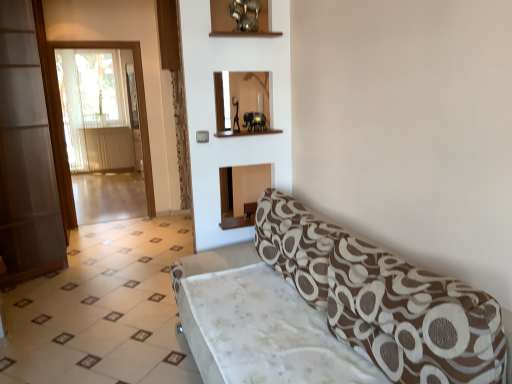
Question: In terms of width, does brown textured fabric studio couch at lower right look wider or thinner when compared to white glossy tile at lower left?

Choices:
 (A) wide
 (B) thin

Answer: (B)

Question: In terms of height, does brown textured fabric studio couch at lower right look taller or shorter compared to white glossy tile at lower left?

Choices:
 (A) short
 (B) tall

Answer: (B)

Question: Which of these objects is positioned farthest from the transparent glass screen door at left, placed as the second screen door when sorted from back to front?

Choices:
 (A) transparent glass screen door at left, the 2th screen door in the front-to-back sequence
 (B) white glossy tile at lower left
 (C) brown textured fabric studio couch at lower right

Answer: (C)

Question: Which object is the farthest from the transparent glass screen door at left, marked as the first screen door in a back-to-front arrangement?

Choices:
 (A) transparent glass screen door at left, placed as the second screen door when sorted from back to front
 (B) brown textured fabric studio couch at lower right
 (C) white glossy tile at lower left

Answer: (B)